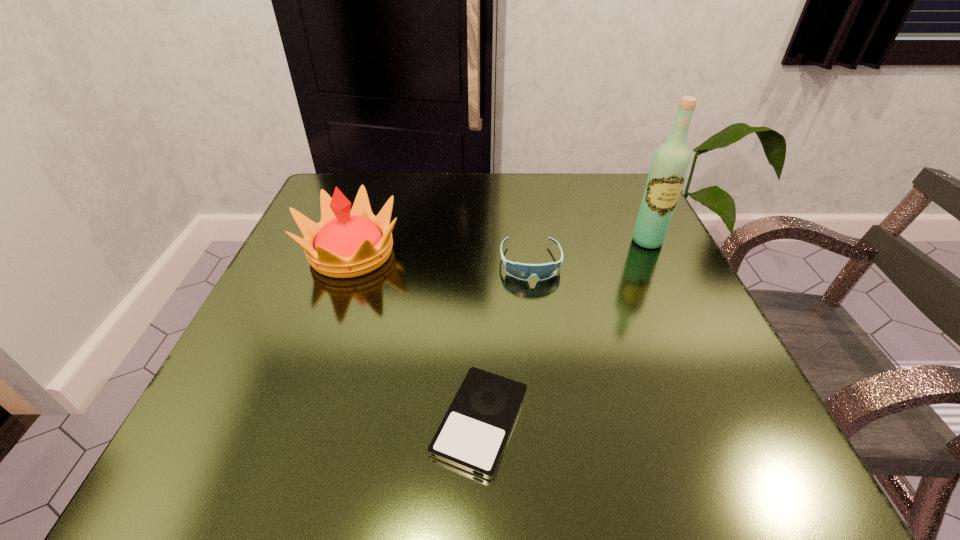
I want to click on the rightmost object, so click(x=669, y=167).

This screenshot has height=540, width=960. I want to click on wine bottle, so click(x=669, y=167).

Locate an element on the screen. The image size is (960, 540). crown is located at coordinates (346, 243).

At what (x,y) coordinates should I click in order to perform the action: click on the leftmost object. Please return your answer as a coordinate pair (x, y). Looking at the image, I should click on (346, 243).

I want to click on goggles, so click(x=521, y=271).

The image size is (960, 540). What are the coordinates of `iPod` in the screenshot? It's located at (473, 434).

Locate an element on the screen. This screenshot has height=540, width=960. the nearest object is located at coordinates (473, 434).

At what (x,y) coordinates should I click in order to perform the action: click on free space located on the front-facing side of the tallest object. Please return your answer as a coordinate pair (x, y). Looking at the image, I should click on (701, 352).

Find the location of a particular element. The image size is (960, 540). vacant area situated on the front of the crown is located at coordinates (300, 396).

In order to click on vacant space located on the front-facing side of the second shortest object in this screenshot , I will do `click(551, 414)`.